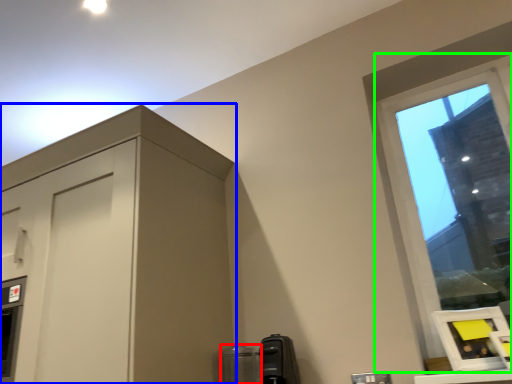
Question: Which is farther away from appliance (highlighted by a red box)? dresser (highlighted by a blue box) or window (highlighted by a green box)?

Choices:
 (A) dresser
 (B) window

Answer: (B)